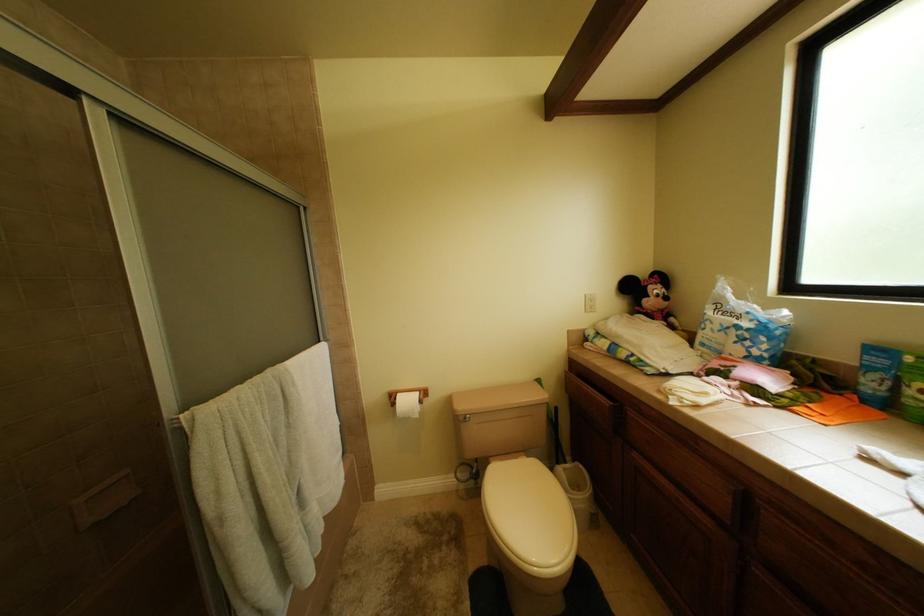
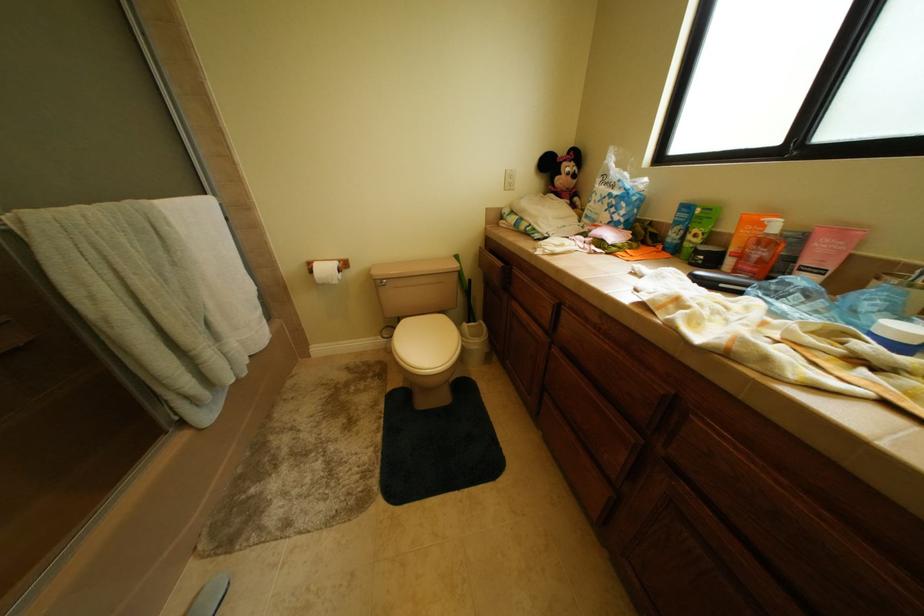
Question: Based on the continuous images, in which direction is the camera rotating? Reply with the corresponding letter.

Choices:
 (A) Left
 (B) Right
 (C) Up
 (D) Down

Answer: (D)